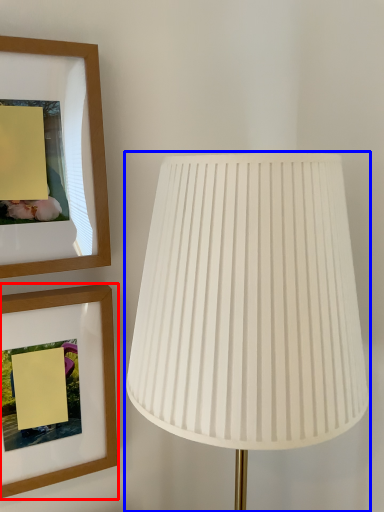
Question: Among these objects, which one is farthest to the camera, picture frame (highlighted by a red box) or lamp (highlighted by a blue box)?

Choices:
 (A) picture frame
 (B) lamp

Answer: (A)